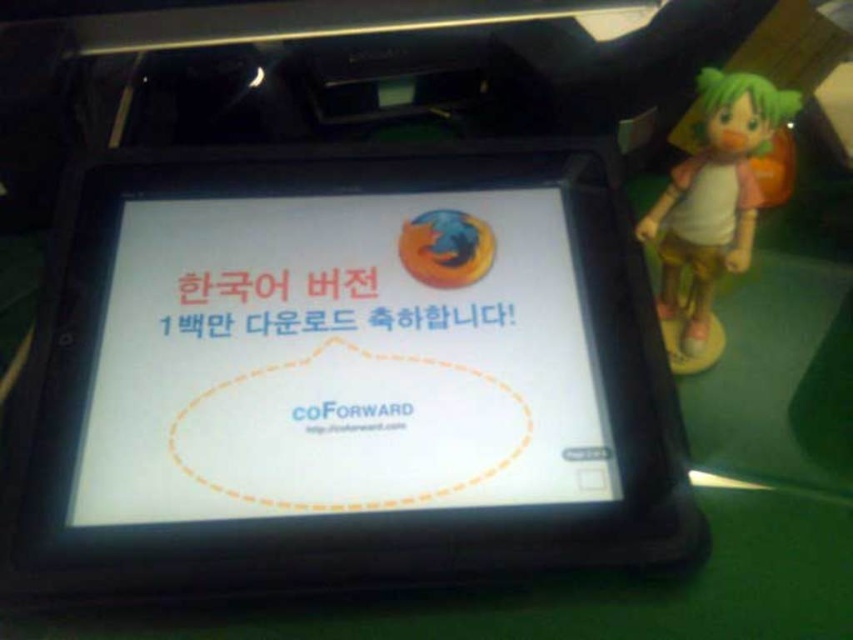
Question: Which point is closer to the camera taking this photo?

Choices:
 (A) (677, 339)
 (B) (276, 451)

Answer: (B)

Question: Which of the following is the closest to the observer?

Choices:
 (A) (738, 116)
 (B) (363, 429)

Answer: (A)

Question: Which object appears closest to the camera in this image?

Choices:
 (A) green matte figure at right
 (B) white glossy screen at center

Answer: (B)

Question: Does white glossy screen at center come behind green matte figure at right?

Choices:
 (A) no
 (B) yes

Answer: (A)

Question: In this image, where is white glossy screen at center located relative to green matte figure at right?

Choices:
 (A) above
 (B) below

Answer: (B)

Question: Can you confirm if white glossy screen at center is wider than green matte figure at right?

Choices:
 (A) yes
 (B) no

Answer: (A)